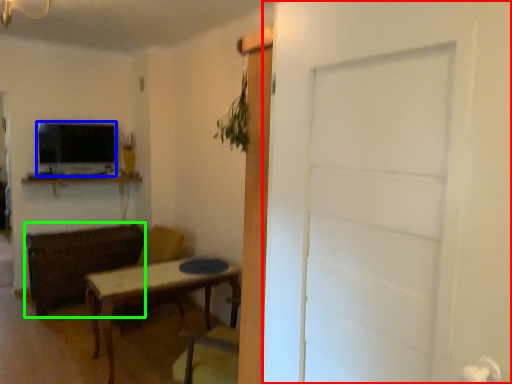
Question: Estimate the real-world distances between objects in this image. Which object is closer to door (highlighted by a red box), television (highlighted by a blue box) or brown (highlighted by a green box)?

Choices:
 (A) television
 (B) brown

Answer: (B)